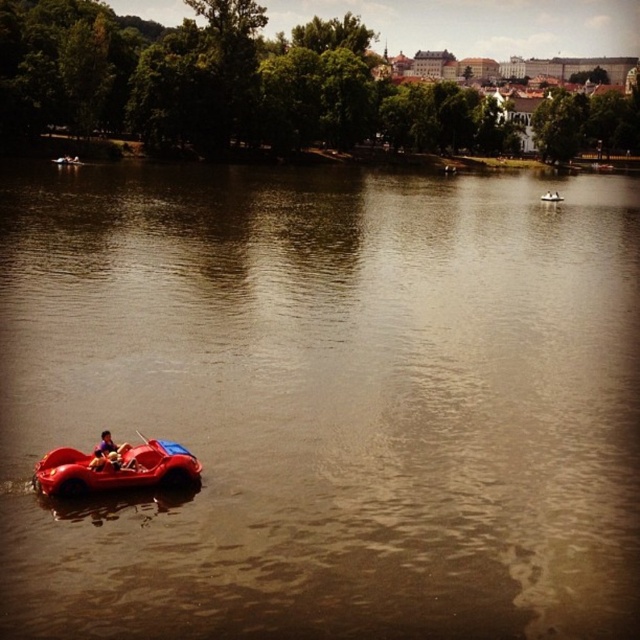
Question: Can you confirm if shiny red car at lower left is smaller than matte red pedal boat at center?

Choices:
 (A) yes
 (B) no

Answer: (A)

Question: Is smooth plastic paddle boat at lower left further to the viewer compared to red rubber boat at lower left?

Choices:
 (A) yes
 (B) no

Answer: (B)

Question: Which point is closer to the camera?

Choices:
 (A) (58, 163)
 (B) (88, 492)
 (C) (99, 451)

Answer: (B)

Question: Does red rubber boat at lower left have a larger size compared to matte red pedal boat at center?

Choices:
 (A) no
 (B) yes

Answer: (B)

Question: Which object is the farthest from the shiny red car at lower left?

Choices:
 (A) red rubber boat at lower left
 (B) matte red pedal boat at center

Answer: (B)

Question: Which of the following is the closest to the observer?

Choices:
 (A) red rubber boat at lower left
 (B) smooth plastic paddle boat at lower left
 (C) shiny red car at lower left

Answer: (C)